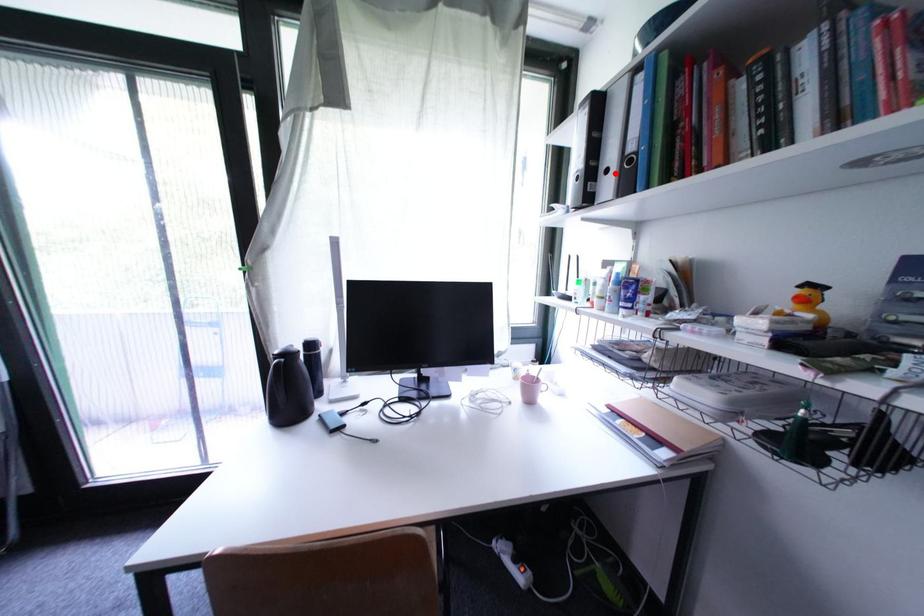
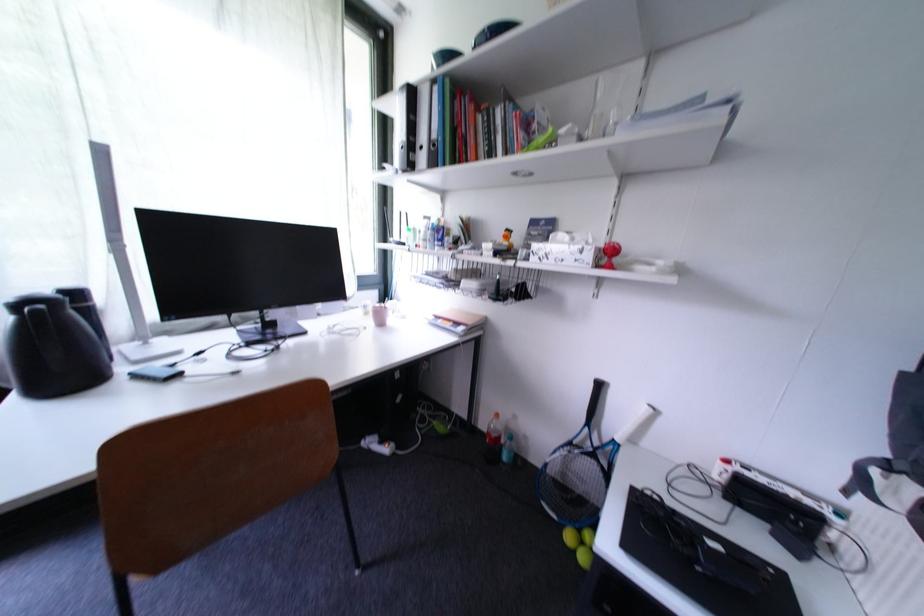
Where in the second image is the point corresponding to the highlighted location from the first image?

(430, 150)